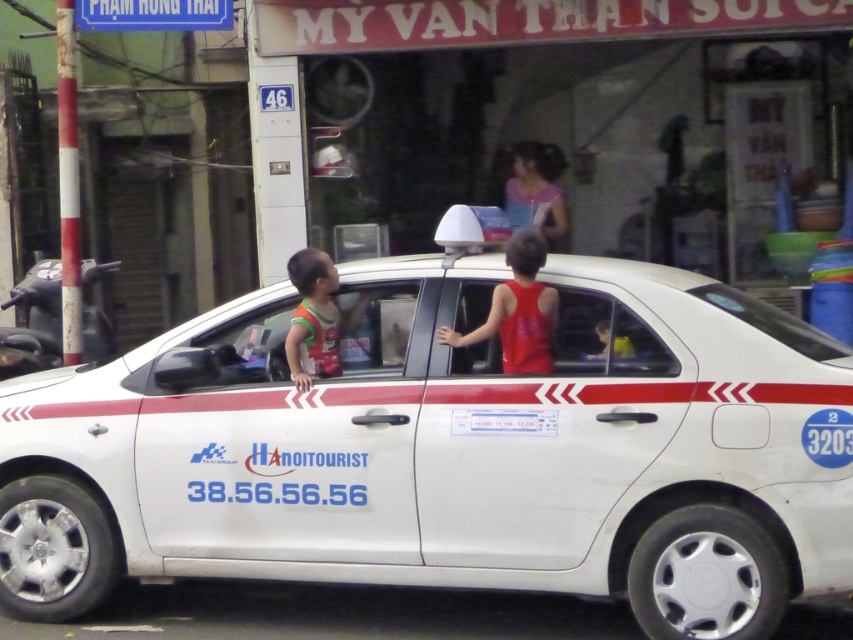
Which of these two, white matte taxi at center or yellow fabric shirt at center, stands taller?

white matte taxi at center

Is white matte taxi at center closer to the viewer compared to yellow fabric shirt at center?

Yes, white matte taxi at center is closer to the viewer.

Between point (755, 564) and point (619, 346), which one is positioned in front?

Point (755, 564)

In order to click on white matte taxi at center in this screenshot , I will do `click(450, 449)`.

Is red matte tank top at center positioned before pink fabric shirt at upper center?

Yes, it is in front of pink fabric shirt at upper center.

Is point (529, 266) farther from viewer compared to point (521, 182)?

No, (529, 266) is closer to viewer.

This screenshot has width=853, height=640. Find the location of `red matte tank top at center`. red matte tank top at center is located at coordinates (517, 310).

Which of these two, white matte taxi at center or orange fabric vest at center, stands shorter?

Standing shorter between the two is orange fabric vest at center.

Between white matte taxi at center and orange fabric vest at center, which one is positioned higher?

orange fabric vest at center is above.

Identify the location of white matte taxi at center. The image size is (853, 640). (450, 449).